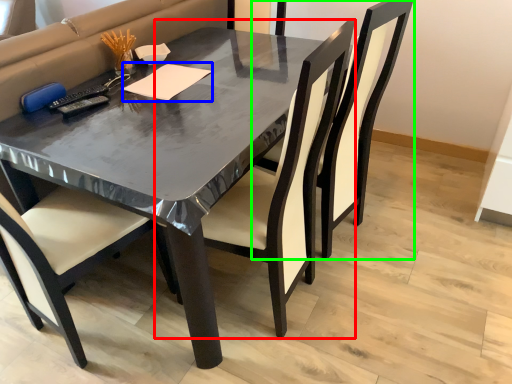
Question: Estimate the real-world distances between objects in this image. Which object is farther from chair (highlighted by a red box), notepad (highlighted by a blue box) or chair (highlighted by a green box)?

Choices:
 (A) notepad
 (B) chair

Answer: (A)